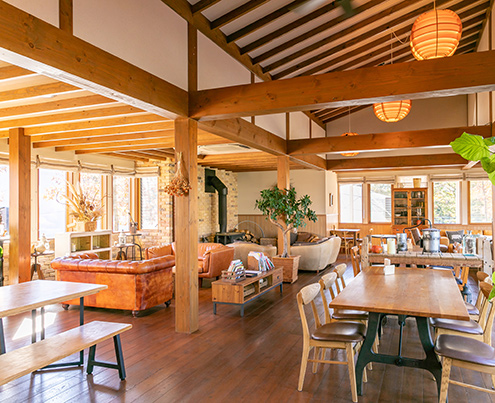
Find the location of a particular element. The height and width of the screenshot is (403, 495). wooden beams is located at coordinates (383, 84), (402, 139), (411, 164), (143, 97), (234, 126), (318, 162).